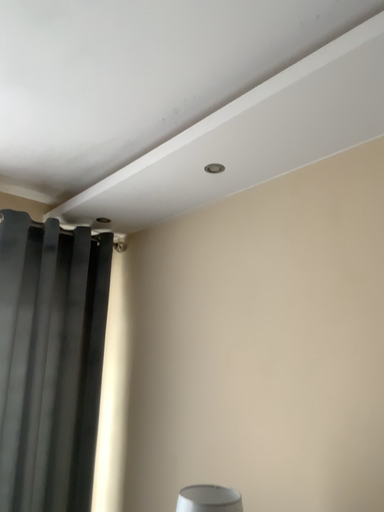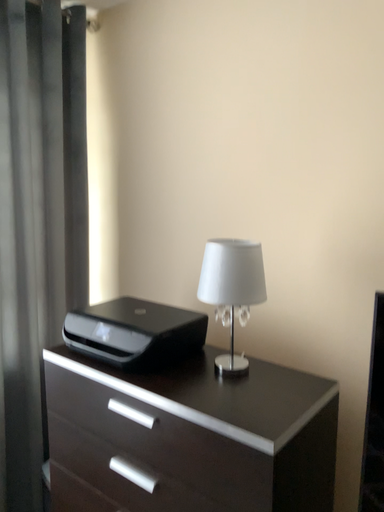
Question: Which way did the camera rotate in the video?

Choices:
 (A) rotated right
 (B) rotated left

Answer: (A)